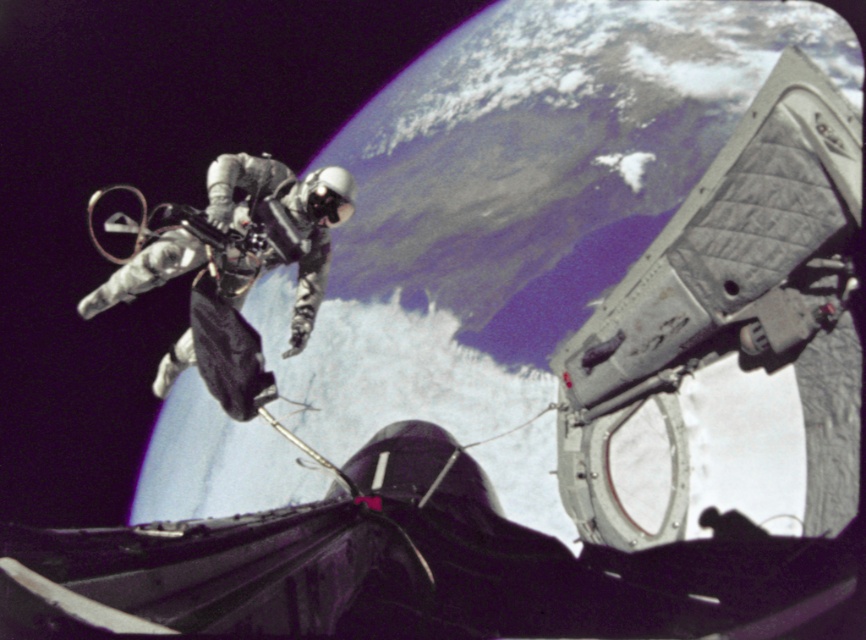
Question: Is gray quilted fabric at upper right above silver metallic spacesuit at center?

Choices:
 (A) yes
 (B) no

Answer: (B)

Question: Can you confirm if gray quilted fabric at upper right is positioned to the right of silver metallic spacesuit at center?

Choices:
 (A) no
 (B) yes

Answer: (B)

Question: Can you confirm if gray quilted fabric at upper right is bigger than silver metallic spacesuit at center?

Choices:
 (A) yes
 (B) no

Answer: (B)

Question: Which point appears farthest from the camera in this image?

Choices:
 (A) (280, 227)
 (B) (692, 348)

Answer: (A)